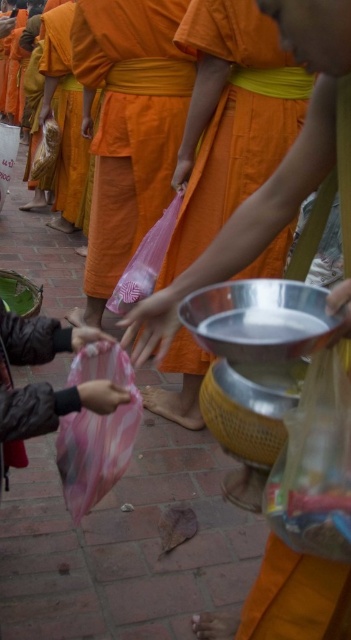
You are an observer at the alms ceremony. You notice the orange cloth at left and the smooth plastic bag at center. Which object takes up more space in the scene?

The orange cloth at left has a larger size compared to the smooth plastic bag at center, so it takes up more space in the scene.

You are a photographer trying to capture the interaction between the orange cloth at left and the smooth plastic bag at center. Based on their positions, which object is closer to the left edge of the photo?

The orange cloth at left is closer to the left edge of the photo because it is positioned to the left of the smooth plastic bag at center.